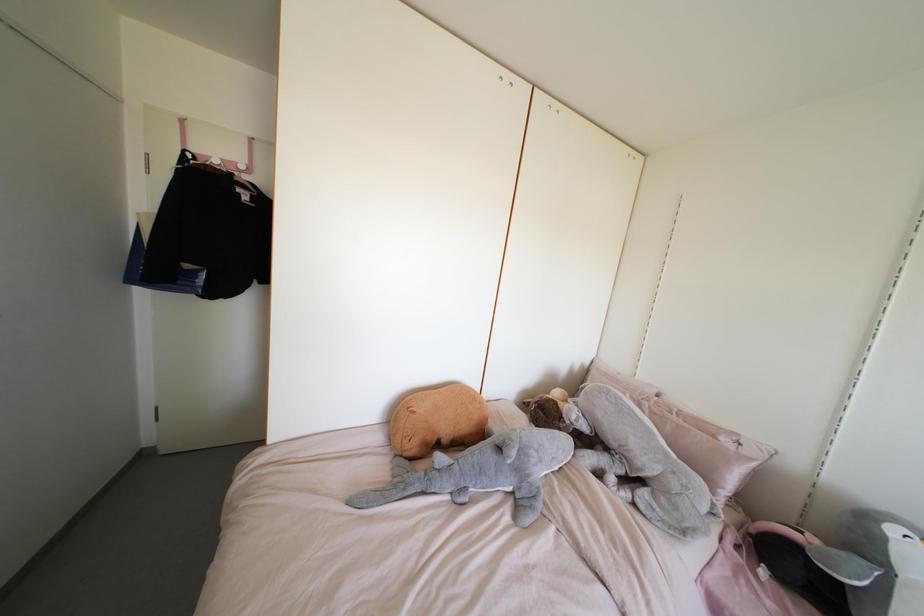
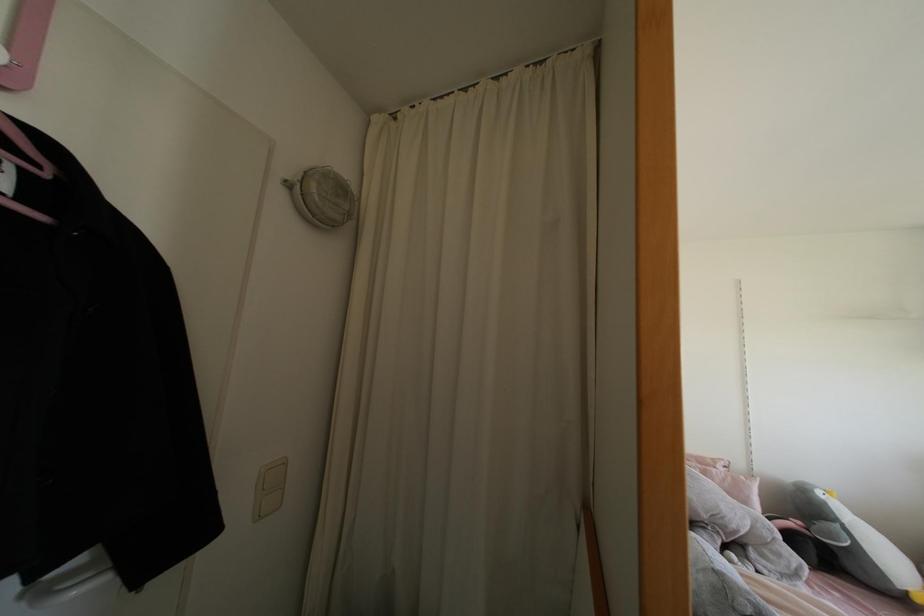
Locate, in the second image, the point that corresponds to (x=892, y=530) in the first image.

(819, 493)